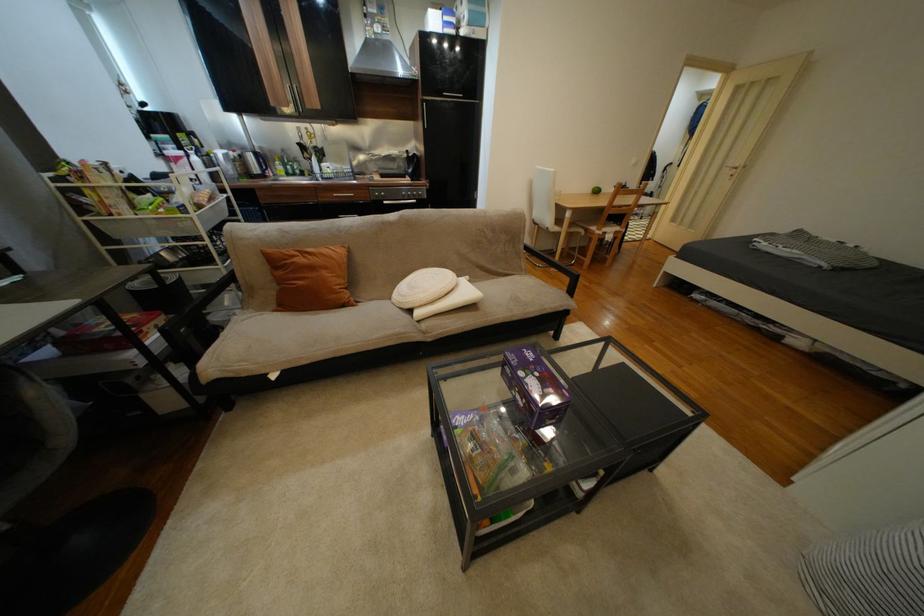
Where would you lift the white round cushion? Please return your answer as a coordinate pair (x, y).

(422, 286)